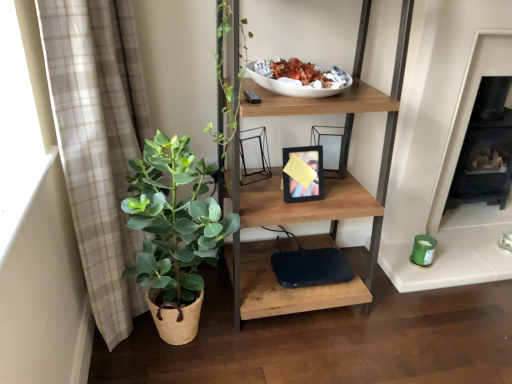
Question: Is beige plaid curtain at left thinner than green leafy plant in woven basket at left?

Choices:
 (A) yes
 (B) no

Answer: (A)

Question: From a real-world perspective, is beige plaid curtain at left beneath green leafy plant in woven basket at left?

Choices:
 (A) yes
 (B) no

Answer: (B)

Question: From the image's perspective, is beige plaid curtain at left located beneath green leafy plant in woven basket at left?

Choices:
 (A) yes
 (B) no

Answer: (B)

Question: Considering the relative positions of beige plaid curtain at left and green leafy plant in woven basket at left in the image provided, is beige plaid curtain at left in front of green leafy plant in woven basket at left?

Choices:
 (A) yes
 (B) no

Answer: (A)

Question: From a real-world perspective, is beige plaid curtain at left physically above green leafy plant in woven basket at left?

Choices:
 (A) no
 (B) yes

Answer: (B)

Question: Does beige plaid curtain at left lie behind green leafy plant in woven basket at left?

Choices:
 (A) yes
 (B) no

Answer: (B)

Question: Is beige plaid curtain at left surrounded by black matte fireplace at right?

Choices:
 (A) no
 (B) yes

Answer: (A)

Question: Is black matte fireplace at right beside beige plaid curtain at left?

Choices:
 (A) yes
 (B) no

Answer: (B)

Question: Is black matte fireplace at right completely or partially outside of beige plaid curtain at left?

Choices:
 (A) no
 (B) yes

Answer: (B)

Question: Is black matte fireplace at right wider than beige plaid curtain at left?

Choices:
 (A) yes
 (B) no

Answer: (A)

Question: Is the position of black matte fireplace at right more distant than that of beige plaid curtain at left?

Choices:
 (A) no
 (B) yes

Answer: (B)

Question: Considering the relative positions of black matte fireplace at right and beige plaid curtain at left in the image provided, is black matte fireplace at right in front of beige plaid curtain at left?

Choices:
 (A) yes
 (B) no

Answer: (B)

Question: From the image's perspective, is wooden shelf at center under beige plaid curtain at left?

Choices:
 (A) no
 (B) yes

Answer: (A)